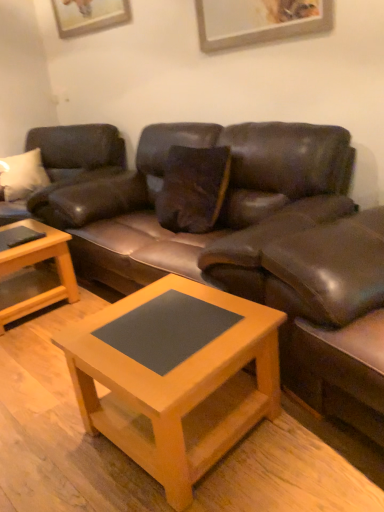
Question: Which direction should I rotate to face matte wood coffee table at center, the first coffee table viewed from the right, — up or down?

Choices:
 (A) up
 (B) down

Answer: (B)

Question: Is light brown wooden coffee table at lower left, which is the 1th coffee table from left to right, surrounding matte wood coffee table at center, marked as the 1th coffee table in a front-to-back arrangement?

Choices:
 (A) no
 (B) yes

Answer: (A)

Question: Considering the relative positions of light brown wooden coffee table at lower left, which appears as the 1th coffee table when viewed from the back, and matte wood coffee table at center, the first coffee table viewed from the right, in the image provided, is light brown wooden coffee table at lower left, which appears as the 1th coffee table when viewed from the back, behind matte wood coffee table at center, the first coffee table viewed from the right,?

Choices:
 (A) yes
 (B) no

Answer: (A)

Question: Does light brown wooden coffee table at lower left, which is the 1th coffee table from left to right, have a smaller size compared to matte wood coffee table at center, marked as the 1th coffee table in a front-to-back arrangement?

Choices:
 (A) yes
 (B) no

Answer: (A)

Question: Does light brown wooden coffee table at lower left, which appears as the 1th coffee table when viewed from the back, have a larger size compared to matte wood coffee table at center, the second coffee table from the back?

Choices:
 (A) no
 (B) yes

Answer: (A)

Question: Considering the relative sizes of light brown wooden coffee table at lower left, which appears as the 1th coffee table when viewed from the back, and matte wood coffee table at center, the first coffee table viewed from the right, in the image provided, is light brown wooden coffee table at lower left, which appears as the 1th coffee table when viewed from the back, shorter than matte wood coffee table at center, the first coffee table viewed from the right,?

Choices:
 (A) no
 (B) yes

Answer: (B)

Question: Can you confirm if light brown wooden coffee table at lower left, the 2th coffee table when ordered from right to left, is thinner than matte wood coffee table at center, the second coffee table viewed from the left?

Choices:
 (A) no
 (B) yes

Answer: (B)

Question: Is matte brown leather couch at left, acting as the second studio couch starting from the right, next to leather swivel chair at right and touching it?

Choices:
 (A) no
 (B) yes

Answer: (A)

Question: Can you confirm if matte brown leather couch at left, which ranks as the 1th studio couch in left-to-right order, is shorter than leather swivel chair at right?

Choices:
 (A) no
 (B) yes

Answer: (A)

Question: From a real-world perspective, is matte brown leather couch at left, acting as the second studio couch starting from the right, on leather swivel chair at right?

Choices:
 (A) yes
 (B) no

Answer: (A)

Question: From a real-world perspective, does matte brown leather couch at left, which ranks as the 1th studio couch in left-to-right order, sit lower than leather swivel chair at right?

Choices:
 (A) yes
 (B) no

Answer: (B)

Question: From the image's perspective, is matte brown leather couch at left, which ranks as the 1th studio couch in left-to-right order, located above leather swivel chair at right?

Choices:
 (A) yes
 (B) no

Answer: (A)

Question: Is matte brown leather couch at left, acting as the second studio couch starting from the right, aimed at leather swivel chair at right?

Choices:
 (A) no
 (B) yes

Answer: (A)

Question: Is leather swivel chair at right far away from brown leather couch at center, the 1th studio couch from the right?

Choices:
 (A) no
 (B) yes

Answer: (A)